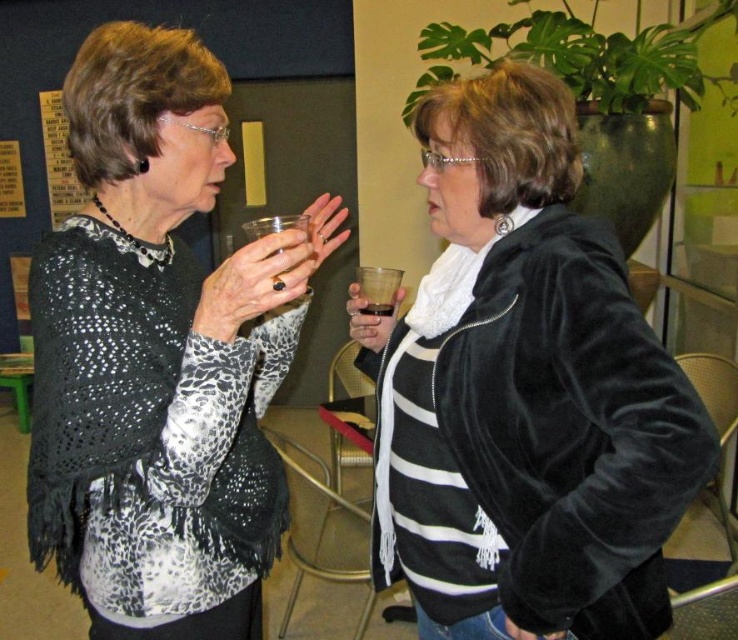
Can you confirm if matte black sweater at center is wider than transparent plastic cup at upper center?

Correct, the width of matte black sweater at center exceeds that of transparent plastic cup at upper center.

Is matte black sweater at center shorter than transparent plastic cup at upper center?

No.

This screenshot has width=738, height=640. Describe the element at coordinates (159, 355) in the screenshot. I see `matte black sweater at center` at that location.

Locate an element on the screen. The width and height of the screenshot is (738, 640). matte black sweater at center is located at coordinates (159, 355).

Does velvet black jacket at center have a greater width compared to dark red glass at center?

Indeed, velvet black jacket at center has a greater width compared to dark red glass at center.

Who is shorter, velvet black jacket at center or dark red glass at center?

dark red glass at center is shorter.

Image resolution: width=738 pixels, height=640 pixels. Find the location of `velvet black jacket at center`. velvet black jacket at center is located at coordinates (524, 392).

Can you confirm if matte black sweater at center is thinner than translucent plastic cup at center?

Incorrect, matte black sweater at center's width is not less than translucent plastic cup at center's.

Is matte black sweater at center to the left of translucent plastic cup at center from the viewer's perspective?

Yes, matte black sweater at center is to the left of translucent plastic cup at center.

Where is `matte black sweater at center`? The width and height of the screenshot is (738, 640). matte black sweater at center is located at coordinates (159, 355).